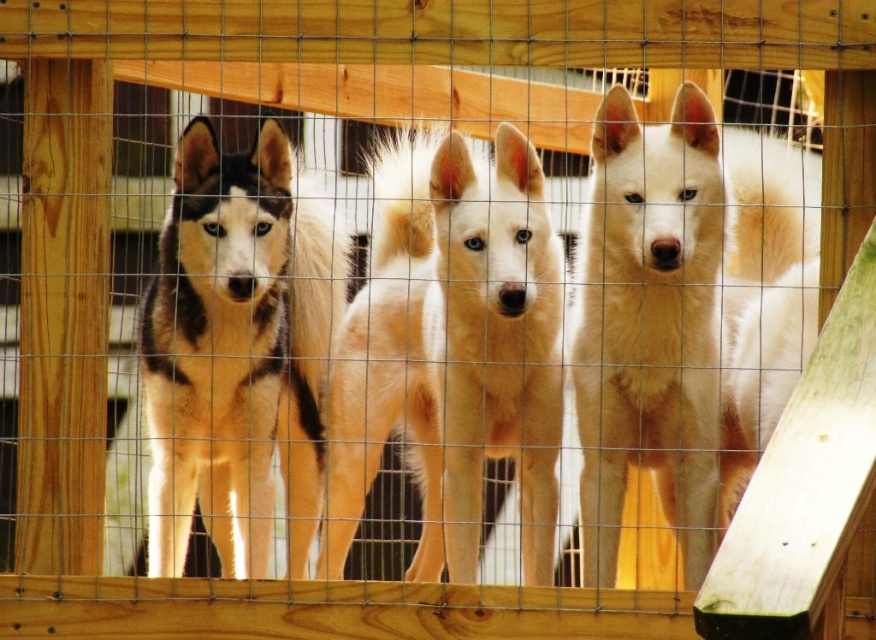
Question: Which point is farther to the camera?

Choices:
 (A) (274, 134)
 (B) (682, 205)

Answer: (A)

Question: Based on their relative distances, which object is nearer to the black and white fur at center?

Choices:
 (A) white fluffy dog at center
 (B) light brown fur at center

Answer: (B)

Question: Does light brown fur at center appear under white fluffy dog at center?

Choices:
 (A) yes
 (B) no

Answer: (A)

Question: Which point is closer to the camera taking this photo?

Choices:
 (A) (612, 428)
 (B) (338, 316)
 (C) (467, 364)

Answer: (A)

Question: Does light brown fur at center appear on the left side of white fluffy dog at center?

Choices:
 (A) yes
 (B) no

Answer: (A)

Question: Considering the relative positions of light brown fur at center and black and white fur at center in the image provided, where is light brown fur at center located with respect to black and white fur at center?

Choices:
 (A) below
 (B) above

Answer: (B)